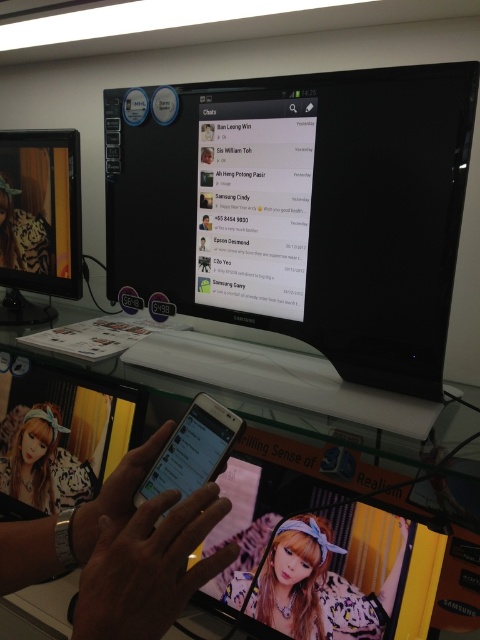
Does black glossy monitor at center appear on the left side of white tiger print jacket at center?

In fact, black glossy monitor at center is to the right of white tiger print jacket at center.

At what (x,y) coordinates should I click in order to perform the action: click on black glossy monitor at center. Please return your answer as a coordinate pair (x, y). This screenshot has width=480, height=640. Looking at the image, I should click on (300, 209).

Is point (228, 208) farther from camera compared to point (8, 468)?

No.

Locate an element on the screen. black glossy monitor at center is located at coordinates (300, 209).

Does black glossy monitor at center have a smaller size compared to matte black monitor at left?

No, black glossy monitor at center is not smaller than matte black monitor at left.

Image resolution: width=480 pixels, height=640 pixels. What do you see at coordinates (300, 209) in the screenshot?
I see `black glossy monitor at center` at bounding box center [300, 209].

In the scene shown: Measure the distance between point (287,291) and camera.

Point (287,291) is 35.31 inches from camera.

The width and height of the screenshot is (480, 640). What are the coordinates of `black glossy monitor at center` in the screenshot? It's located at (300, 209).

Who is lower down, white tiger print jacket at center or tiger print fabric at center?

white tiger print jacket at center

Locate an element on the screen. white tiger print jacket at center is located at coordinates (45, 460).